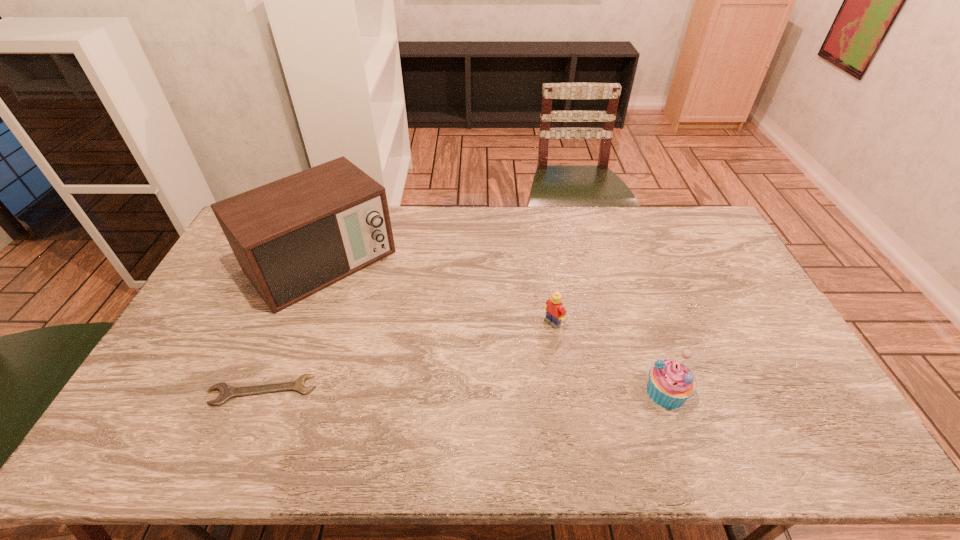
Find the location of a particular element. vacant space on the desktop that is between the shortest object and the rightmost object and is positioned on the front-facing side of the tallest object is located at coordinates (441, 391).

Find the location of `free spot on the desktop that is between the wrench and the rightmost object and is positioned on the front-facing side of the second object from right to left`. free spot on the desktop that is between the wrench and the rightmost object and is positioned on the front-facing side of the second object from right to left is located at coordinates (463, 391).